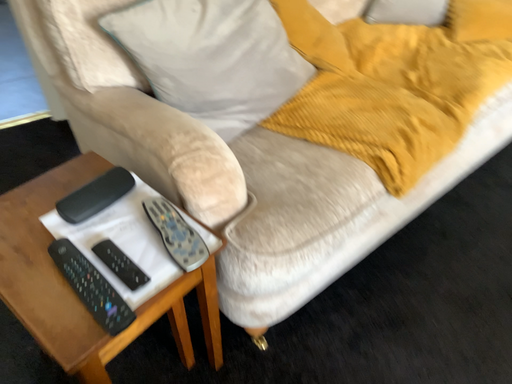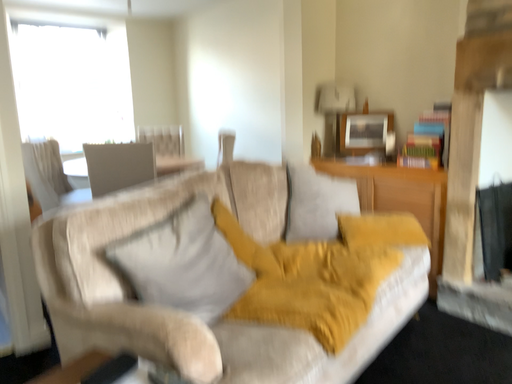
Question: Which way did the camera rotate in the video?

Choices:
 (A) rotated downward
 (B) rotated upward

Answer: (B)